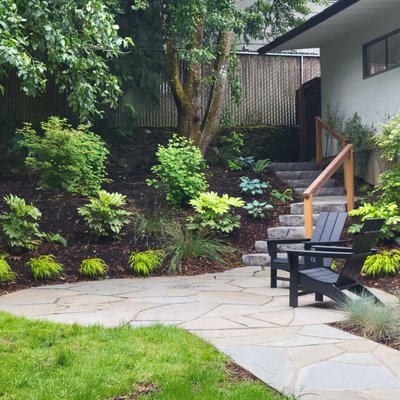
Where is `wood railing`? This screenshot has height=400, width=400. wood railing is located at coordinates (325, 172), (334, 133).